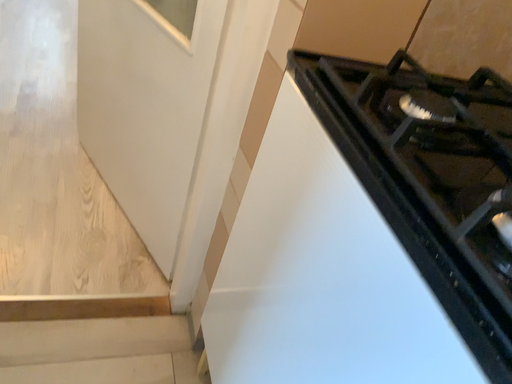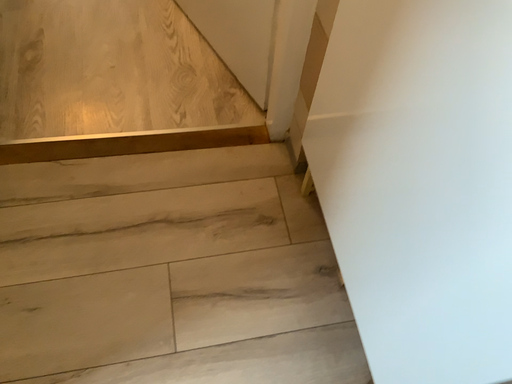
Question: How did the camera likely rotate when shooting the video?

Choices:
 (A) rotated downward
 (B) rotated upward

Answer: (A)